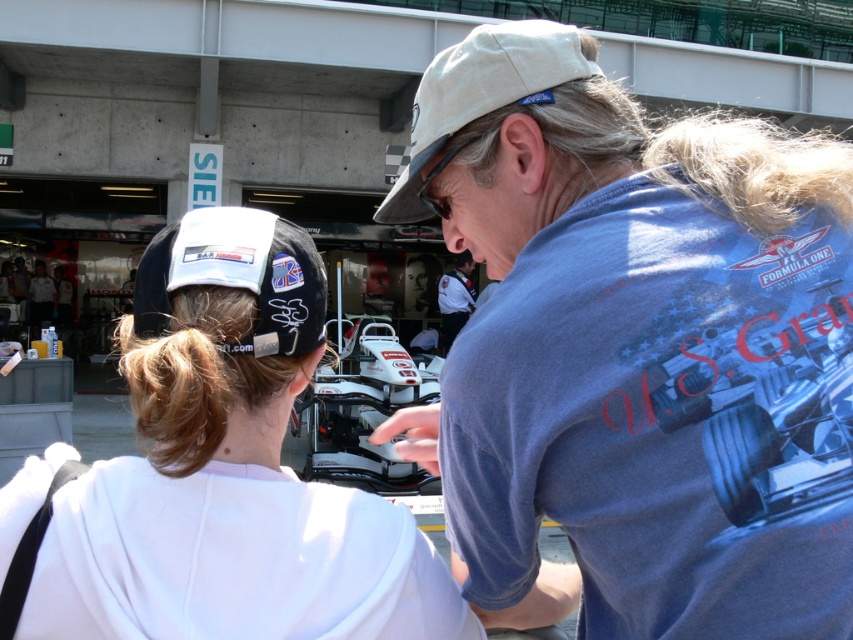
Question: Estimate the real-world distances between objects in this image. Which object is closer to the white matte cap at upper left?

Choices:
 (A) beige fabric baseball cap at center
 (B) white uniform at center
 (C) black fabric baseball cap at upper left

Answer: (C)

Question: Can you confirm if white matte cap at upper left is positioned to the right of black fabric baseball cap at upper left?

Choices:
 (A) yes
 (B) no

Answer: (A)

Question: Is white matte cap at upper left to the left of black fabric baseball cap at upper left from the viewer's perspective?

Choices:
 (A) no
 (B) yes

Answer: (A)

Question: Which point is farther to the camera?

Choices:
 (A) white matte cap at upper center
 (B) black fabric baseball cap at upper left
 (C) white matte cap at upper left

Answer: (B)

Question: Which point is farther to the camera?

Choices:
 (A) (519, 568)
 (B) (252, 552)
 (C) (456, 275)
 (D) (399, 177)

Answer: (C)

Question: Can you confirm if black fabric baseball cap at upper left is positioned to the left of beige fabric baseball cap at center?

Choices:
 (A) no
 (B) yes

Answer: (B)